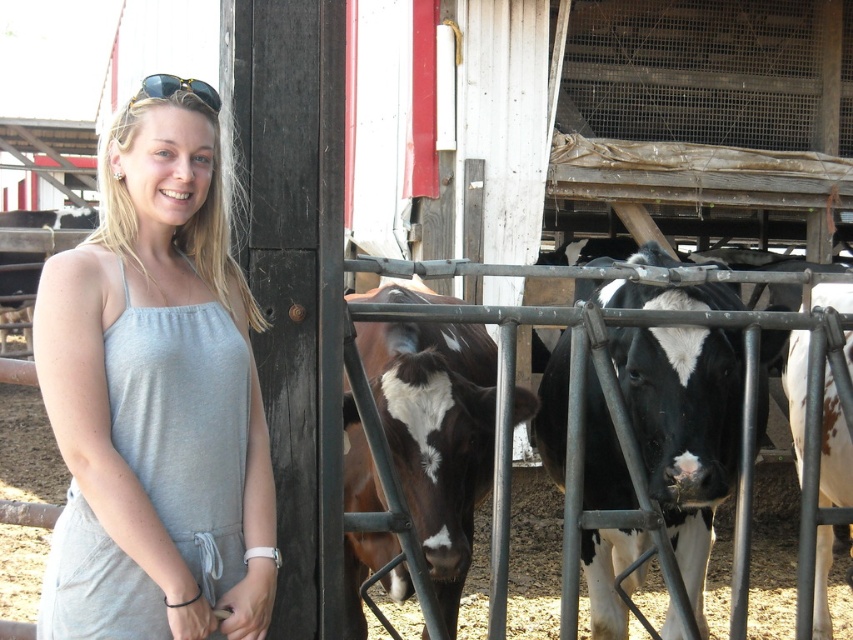
Question: Which point appears farthest from the camera in this image?

Choices:
 (A) (151, 97)
 (B) (532, 401)
 (C) (720, 346)
 (D) (225, 264)

Answer: (C)

Question: Among these objects, which one is farthest from the camera?

Choices:
 (A) gold metallic sunglasses at upper left
 (B) brown glossy cow at center

Answer: (B)

Question: Can you confirm if black and white fur at center is positioned to the right of brown glossy cow at center?

Choices:
 (A) yes
 (B) no

Answer: (A)

Question: Can you confirm if brown glossy cow at center is bigger than gold metallic sunglasses at upper left?

Choices:
 (A) yes
 (B) no

Answer: (A)

Question: Is gray fabric dress at center bigger than brown glossy cow at center?

Choices:
 (A) no
 (B) yes

Answer: (A)

Question: Which point is closer to the camera?

Choices:
 (A) (206, 97)
 (B) (386, 323)

Answer: (A)